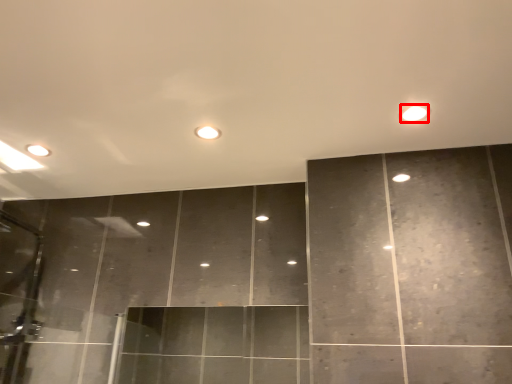
Question: Considering the relative positions of light (annotated by the red box) and light in the image provided, where is light (annotated by the red box) located with respect to the staircase?

Choices:
 (A) left
 (B) right

Answer: (B)